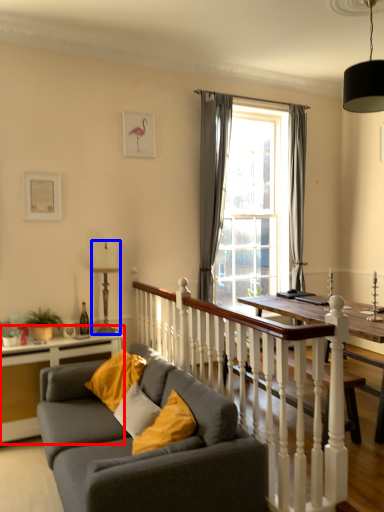
Question: Which point is closer to the camera, table (highlighted by a red box) or lamp (highlighted by a blue box)?

Choices:
 (A) table
 (B) lamp

Answer: (A)